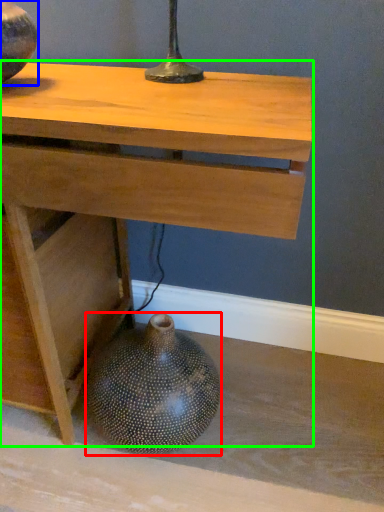
Question: Which object is positioned farthest from vase (highlighted by a red box)? Select from vase (highlighted by a blue box) and table (highlighted by a green box).

Choices:
 (A) vase
 (B) table

Answer: (A)